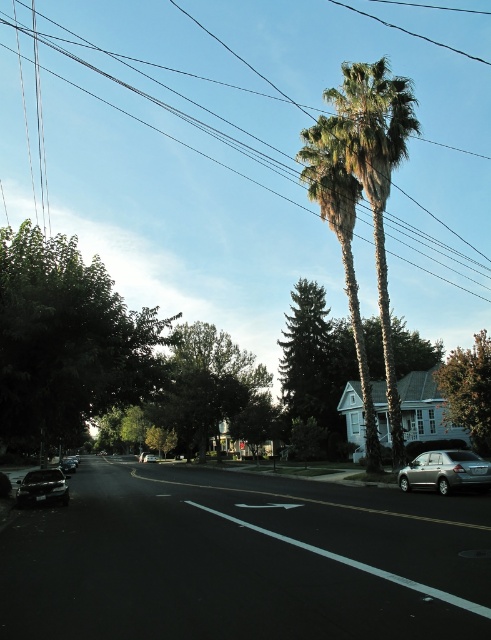
Image resolution: width=491 pixels, height=640 pixels. What do you see at coordinates (65, 340) in the screenshot? I see `green leafy tree at left` at bounding box center [65, 340].

Who is lower down, green leafy tree at left or green leafy tree at center?

green leafy tree at center

Locate an element on the screen. The image size is (491, 640). green leafy tree at left is located at coordinates (65, 340).

Looking at this image, does green leafy palm trees at upper right lie behind shiny black sedan at lower left?

No.

Who is more forward, (365, 392) or (70, 461)?

Point (365, 392) is more forward.

This screenshot has width=491, height=640. In order to click on green leafy palm trees at upper right in this screenshot , I will do `click(358, 196)`.

Is green leafy palm trees at upper right bigger than silver metallic sedan at center?

Indeed, green leafy palm trees at upper right has a larger size compared to silver metallic sedan at center.

Is green leafy palm trees at upper right below silver metallic sedan at center?

Incorrect, green leafy palm trees at upper right is not positioned below silver metallic sedan at center.

What do you see at coordinates (358, 196) in the screenshot? The height and width of the screenshot is (640, 491). I see `green leafy palm trees at upper right` at bounding box center [358, 196].

Locate an element on the screen. Image resolution: width=491 pixels, height=640 pixels. green leafy palm trees at upper right is located at coordinates point(358,196).